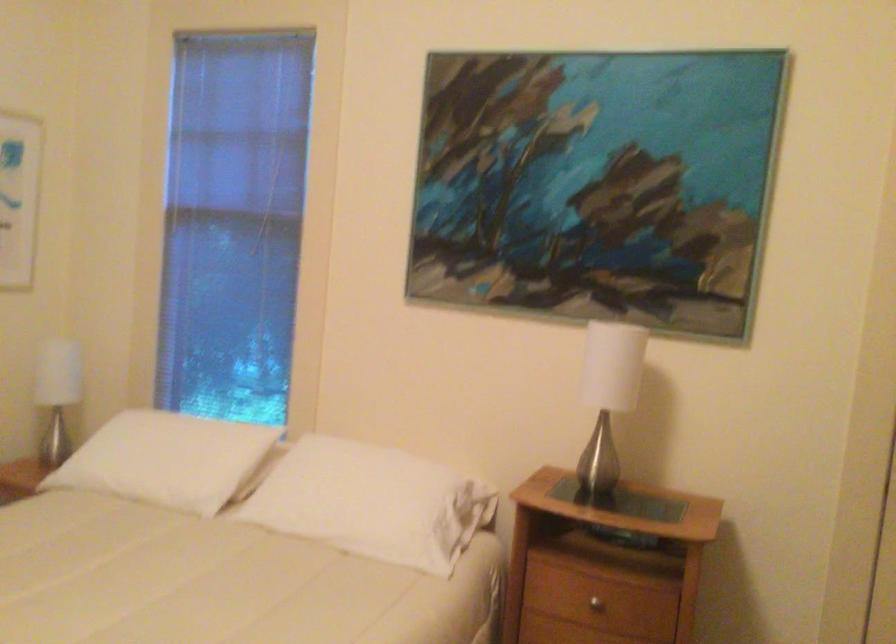
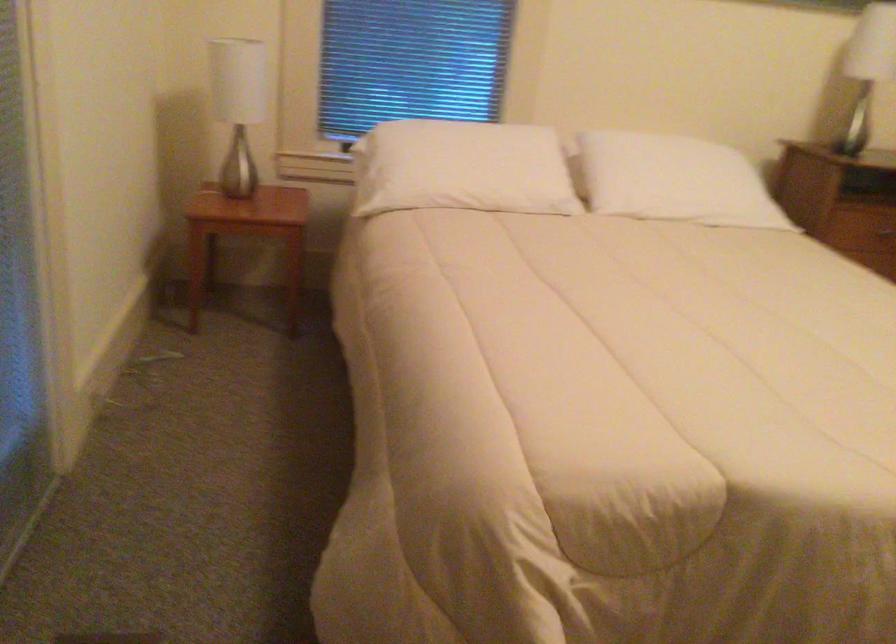
Find the pixel in the second image that matches (x=320, y=507) in the first image.

(673, 180)